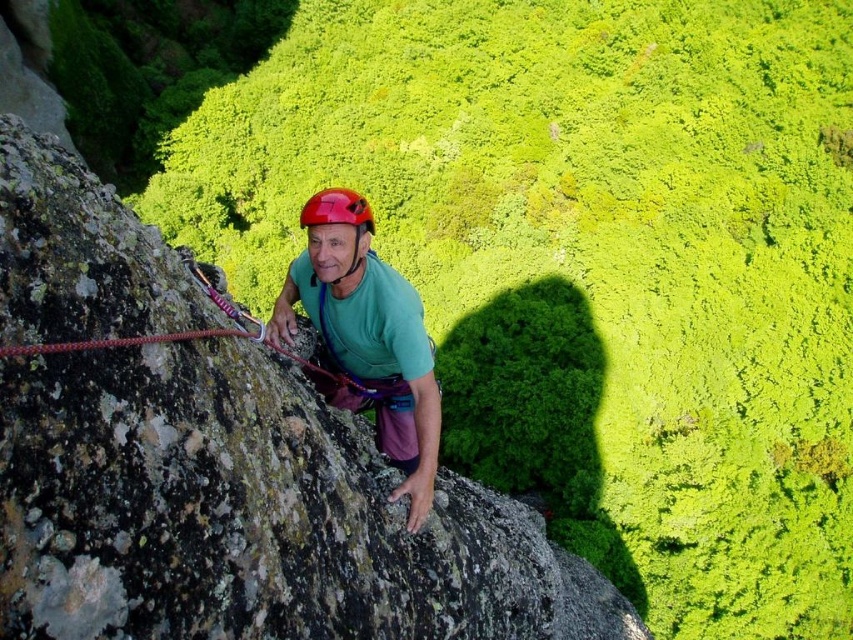
Question: Does green matte helmet at center appear under shiny red helmet at center?

Choices:
 (A) no
 (B) yes

Answer: (B)

Question: Which point is farther to the camera?

Choices:
 (A) shiny red helmet at center
 (B) green matte helmet at center

Answer: (A)

Question: Can you confirm if green matte helmet at center is bigger than shiny red helmet at center?

Choices:
 (A) yes
 (B) no

Answer: (B)

Question: Can you confirm if green matte helmet at center is bigger than shiny red helmet at center?

Choices:
 (A) no
 (B) yes

Answer: (A)